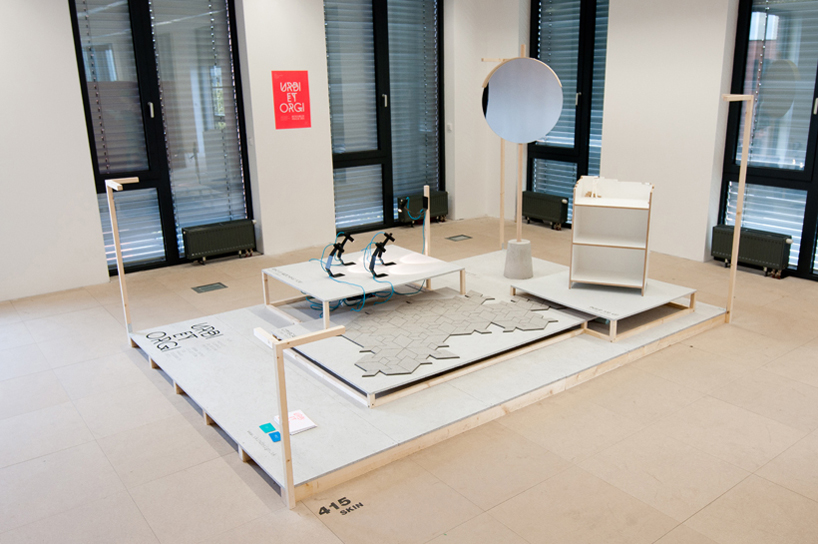
Where is `wall to the left of window`? This screenshot has width=818, height=544. wall to the left of window is located at coordinates (52, 102).